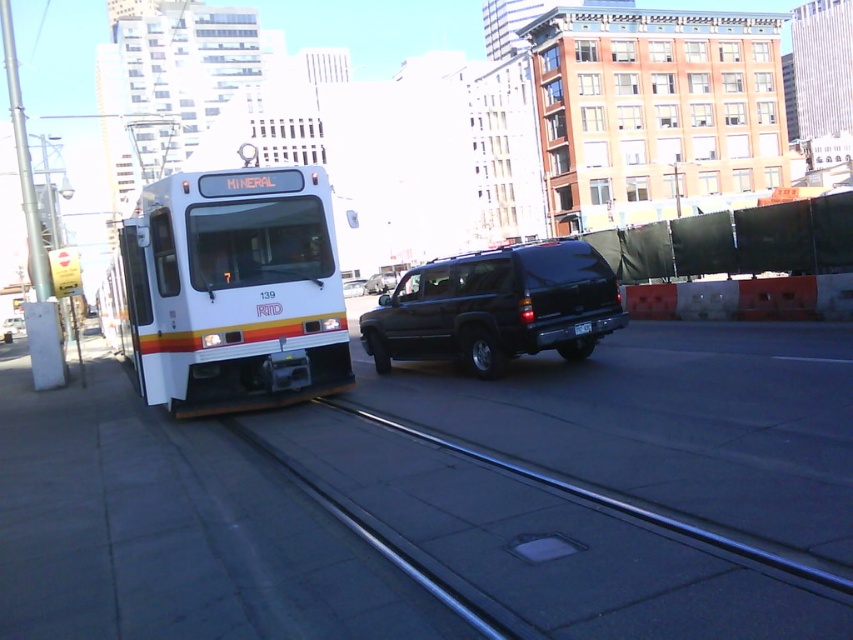
Does black matte suv at center come behind black plastic license plate at center?

No, it is in front of black plastic license plate at center.

The image size is (853, 640). I want to click on black matte suv at center, so click(x=495, y=307).

Locate an element on the screen. The width and height of the screenshot is (853, 640). black matte suv at center is located at coordinates (495, 307).

Between satin black suv at center and black plastic license plate at center, which one has less height?

Standing shorter between the two is black plastic license plate at center.

Is point (376, 275) behind point (587, 330)?

Yes.

Is point (378, 282) positioned in front of point (587, 326)?

No, (378, 282) is further to viewer.

At what (x,y) coordinates should I click in order to perform the action: click on satin black suv at center. Please return your answer as a coordinate pair (x, y). Looking at the image, I should click on (381, 282).

The height and width of the screenshot is (640, 853). I want to click on metallic rail at center, so click(x=538, y=540).

Is point (577, 608) more distant than point (575, 324)?

No, (577, 608) is in front of (575, 324).

Does point (730, 556) come in front of point (581, 330)?

Yes.

Where is `metallic rail at center`? The height and width of the screenshot is (640, 853). metallic rail at center is located at coordinates (538, 540).